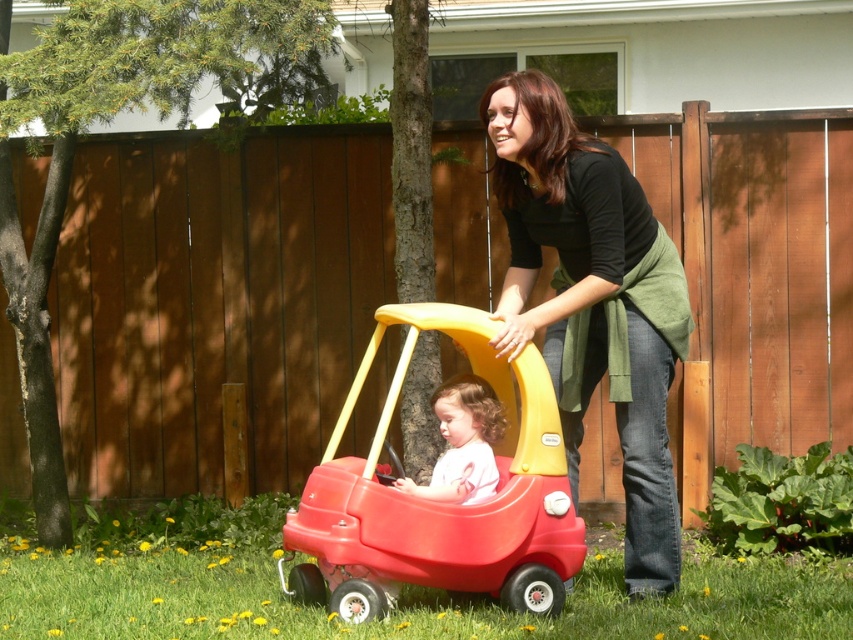
Question: Which of the following is the closest to the observer?

Choices:
 (A) 463,433
 (B) 381,412

Answer: (A)

Question: Can you confirm if black matte shirt at center is thinner than red plastic toy car at center?

Choices:
 (A) no
 (B) yes

Answer: (B)

Question: Estimate the real-world distances between objects in this image. Which object is closer to the matte pink shirt at center?

Choices:
 (A) red plastic toy car at center
 (B) black matte shirt at center

Answer: (A)

Question: Estimate the real-world distances between objects in this image. Which object is farther from the matte pink shirt at center?

Choices:
 (A) red plastic toy car at center
 (B) black matte shirt at center

Answer: (B)

Question: Is red plastic toy car at center below matte pink shirt at center?

Choices:
 (A) yes
 (B) no

Answer: (A)

Question: Does black matte shirt at center have a greater width compared to red plastic toy car at center?

Choices:
 (A) no
 (B) yes

Answer: (A)